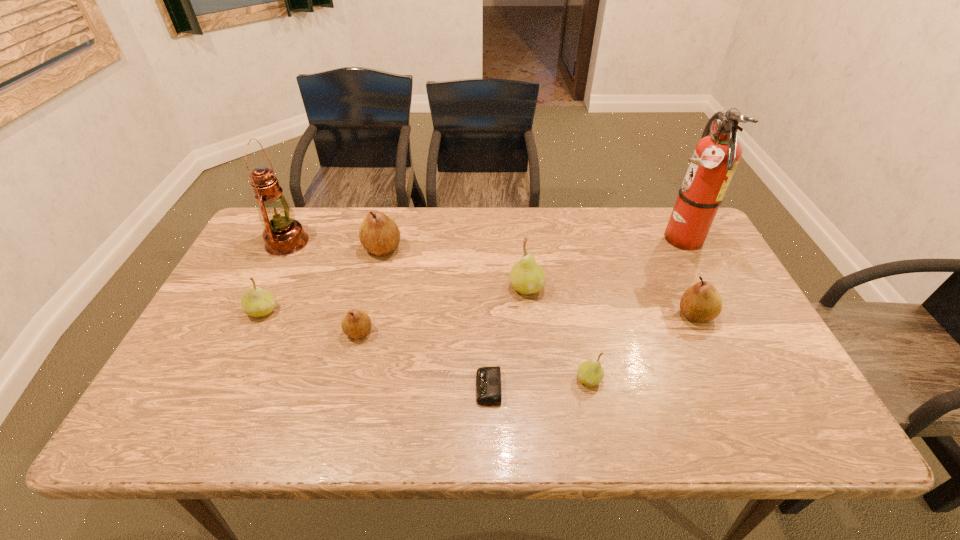
You are a GUI agent. You are given a task and a screenshot of the screen. Output one action in this format:
    pyautogui.click(x=<x>, y=<y>)
    Task: Click on the oil lamp that is at the far edge
    This screenshot has height=540, width=960.
    Given the screenshot: What is the action you would take?
    pyautogui.click(x=283, y=235)

Locate an element on the screen. Image resolution: width=960 pixels, height=540 pixels. pear at the far edge is located at coordinates (378, 233).

You are a GUI agent. You are given a task and a screenshot of the screen. Output one action in this format:
    pyautogui.click(x=<x>, y=<y>)
    Task: Click on the object present at the near edge
    The width and height of the screenshot is (960, 540).
    Given the screenshot: What is the action you would take?
    pyautogui.click(x=488, y=379)

Find the location of `oil lamp that is at the left edge`. oil lamp that is at the left edge is located at coordinates (283, 235).

Identify the location of pear that is at the left edge. (256, 302).

Identify the location of fire extinguisher present at the right edge. pos(716,156).

You are a GUI agent. You are given a task and a screenshot of the screen. Output one action in this format:
    pyautogui.click(x=<x>, y=<y>)
    Task: Click on the pear at the right edge
    The width and height of the screenshot is (960, 540).
    Given the screenshot: What is the action you would take?
    pyautogui.click(x=700, y=303)

Image resolution: width=960 pixels, height=540 pixels. Find the location of `object situated at the far left corner`. object situated at the far left corner is located at coordinates (283, 235).

The height and width of the screenshot is (540, 960). I want to click on object that is at the far right corner, so click(716, 156).

Find the location of a particular element. The width and height of the screenshot is (960, 540). vacant area at the far edge of the desktop is located at coordinates (637, 220).